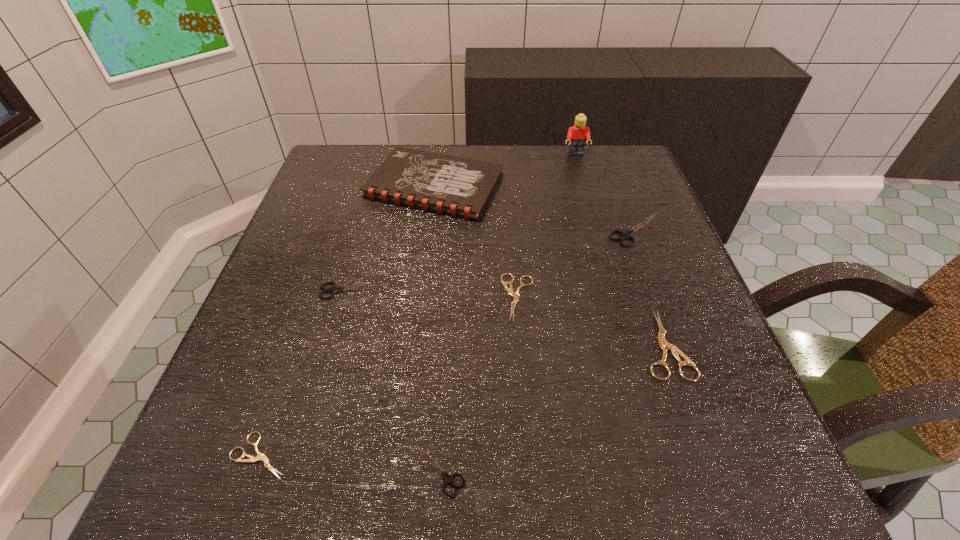
Identify the location of free region located 0.110m on the back of the shortest object. (290, 369).

Where is `Lego at the far edge`? This screenshot has width=960, height=540. Lego at the far edge is located at coordinates (577, 135).

The image size is (960, 540). What are the coordinates of `notebook that is at the far edge` in the screenshot? It's located at (456, 186).

Identify the location of notebook that is at the left edge. This screenshot has height=540, width=960. (456, 186).

Where is `Lego that is at the right edge`? This screenshot has height=540, width=960. Lego that is at the right edge is located at coordinates (577, 135).

You are a GUI agent. You are given a task and a screenshot of the screen. Output one action in this format:
    pyautogui.click(x=<x>, y=<y>)
    Task: Click on the object that is at the far left corner
    The height and width of the screenshot is (540, 960).
    Given the screenshot: What is the action you would take?
    pyautogui.click(x=456, y=186)

You are a GUI agent. You are given a task and a screenshot of the screen. Output one action in this format:
    pyautogui.click(x=<x>, y=<y>)
    Task: Click on the object at the near left corner
    
    Given the screenshot: What is the action you would take?
    pyautogui.click(x=260, y=456)

The image size is (960, 540). Find the location of `object that is at the far right corner`. object that is at the far right corner is located at coordinates (577, 135).

This screenshot has width=960, height=540. In order to click on free space at the far edge in this screenshot , I will do `click(506, 183)`.

This screenshot has height=540, width=960. Identify the location of free space at the near edge. (419, 487).